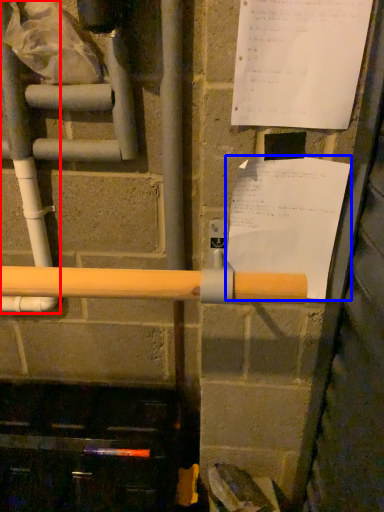
Question: Which object is further to the camera taking this photo, water pipe (highlighted by a red box) or paper (highlighted by a blue box)?

Choices:
 (A) water pipe
 (B) paper

Answer: (A)